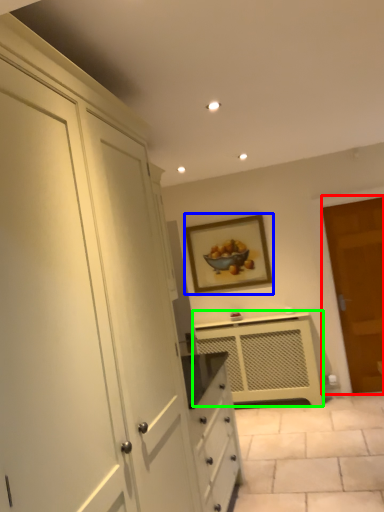
Question: Considering the real-world distances, which object is farthest from door (highlighted by a red box)? picture frame (highlighted by a blue box) or cabinetry (highlighted by a green box)?

Choices:
 (A) picture frame
 (B) cabinetry

Answer: (A)